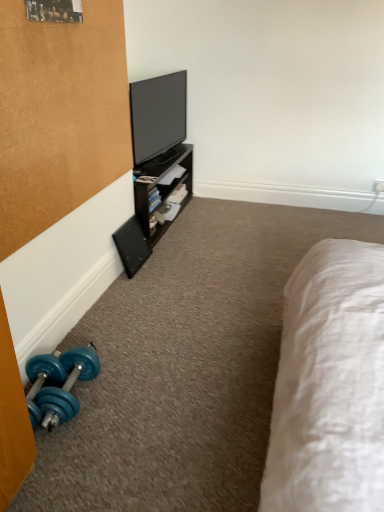
Where is `vacant space to the right of blue rubber dumbbell at lower left`? vacant space to the right of blue rubber dumbbell at lower left is located at coordinates (132, 395).